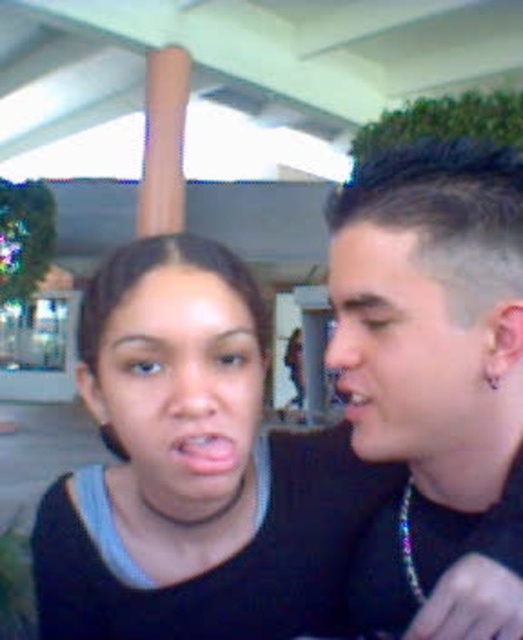
Who is more distant from viewer, (x=361, y=333) or (x=176, y=442)?

Positioned behind is point (x=361, y=333).

This screenshot has width=523, height=640. I want to click on shiny black hair at right, so click(x=435, y=381).

Is point (255, 348) more distant than point (501, 401)?

Yes, it is behind point (501, 401).

Which is above, matte skin face at center or pale skin face at right?

pale skin face at right is above.

Measure the distance between point (215, 436) and camera.

The distance of point (215, 436) from camera is 21.06 inches.

The width and height of the screenshot is (523, 640). Identify the location of matte skin face at center. (181, 385).

Based on the photo, does shiny black hair at right come behind pale skin face at right?

No.

Between point (487, 392) and point (448, 444), which one is positioned in front?

Positioned in front is point (487, 392).

Find the location of a particular element. shiny black hair at right is located at coordinates point(435,381).